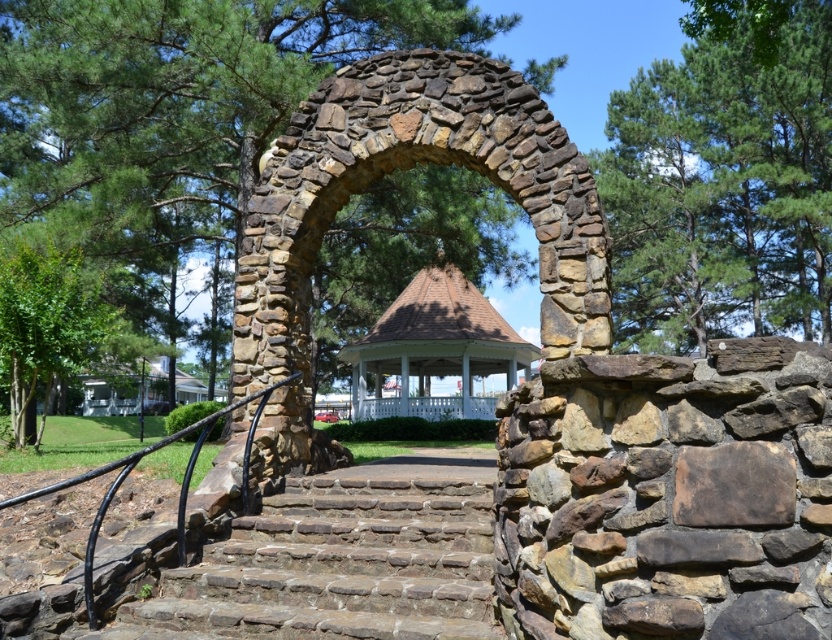
You are planning to place a small potted plant between the brown stone stairs at center and the white wooden gazebo at center. Based on their sizes, which object should the plant be closer to?

The brown stone stairs at center occupies less space than the white wooden gazebo at center, so the plant should be placed closer to the gazebo to balance the space.

You are standing at the base of the brown stone stairs at center and want to reach the white wooden gazebo at center. Which direction should you walk to get there?

You should walk upwards along the brown stone stairs at center to reach the white wooden gazebo at center since it is located above the stairs.